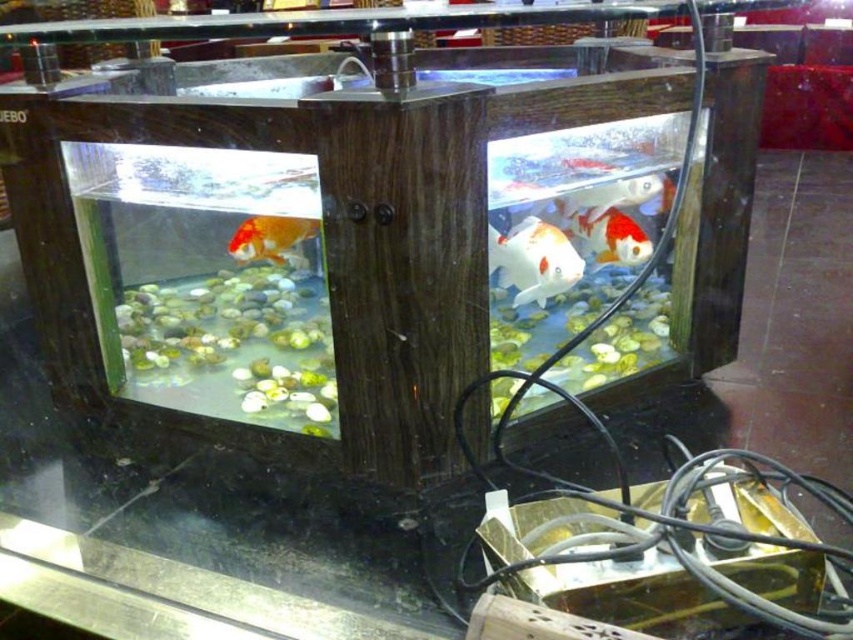
You are a customer at a pet store looking at the two aquariums. You notice the white glossy fish at center and the shiny orange and white fish at right. Which fish is positioned more to the right side?

The shiny orange and white fish at right is positioned more to the right side.

You are a customer at a pet store looking at the two aquariums. You notice the white glossy fish at center and the shiny orange and white fish at right. Which fish would you say is larger in size?

The white glossy fish at center is bigger than the shiny orange and white fish at right, so the white glossy fish at center is larger in size.